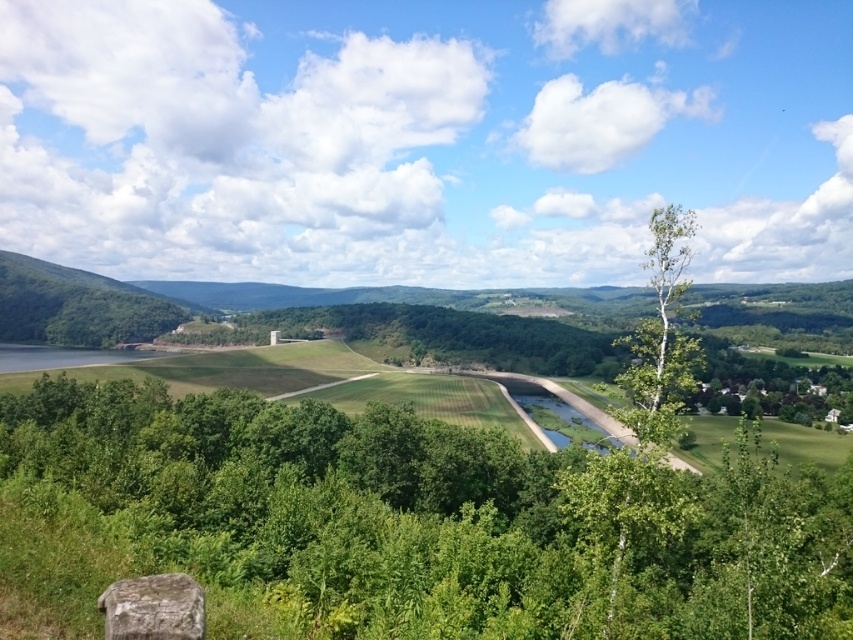
Does white smooth tree at right have a lesser height compared to rusty metallic rock at lower left?

In fact, white smooth tree at right may be taller than rusty metallic rock at lower left.

Is point (672, 307) positioned behind point (171, 604)?

Yes, point (672, 307) is farther from viewer.

Identify the location of white smooth tree at right. (664, 321).

Is point (38, 282) more distant than point (125, 621)?

That is True.

You are a GUI agent. You are given a task and a screenshot of the screen. Output one action in this format:
    pyautogui.click(x=<x>, y=<y>)
    Task: Click on the green leafy tree at left
    Image resolution: width=853 pixels, height=640 pixels.
    Given the screenshot: What is the action you would take?
    pos(76,307)

Where is `green leafy tree at left`? The width and height of the screenshot is (853, 640). green leafy tree at left is located at coordinates (76, 307).

In the scene shown: Which is above, green leafy tree at center or rusty metallic rock at lower left?

rusty metallic rock at lower left is higher up.

Can you confirm if green leafy tree at center is taller than rusty metallic rock at lower left?

Yes.

Is point (283, 541) more distant than point (113, 609)?

Yes.

Find the location of a particular element. The image size is (853, 640). green leafy tree at center is located at coordinates (444, 516).